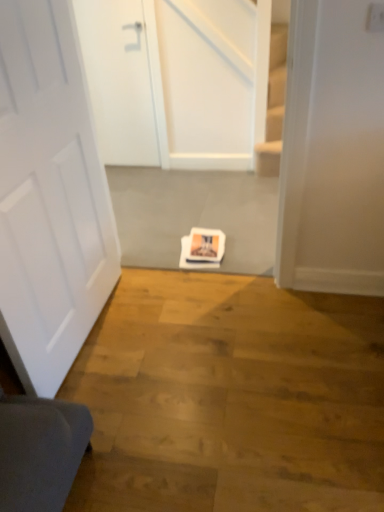
Question: From a real-world perspective, is white matte door at upper left, which ranks as the first door in top-to-bottom order, positioned above or below white matte door at center, the second door when ordered from back to front?

Choices:
 (A) below
 (B) above

Answer: (A)

Question: In terms of height, does white matte door at upper left, arranged as the 1th door when viewed from the back, look taller or shorter compared to white matte door at center, the second door when ordered from back to front?

Choices:
 (A) short
 (B) tall

Answer: (A)

Question: Is point (122, 59) positioned closer to the camera than point (29, 16)?

Choices:
 (A) closer
 (B) farther

Answer: (B)

Question: Considering the positions of white matte door at center, the 2th door from the top, and white matte door at upper left, which ranks as the first door in top-to-bottom order, in the image, is white matte door at center, the 2th door from the top, taller or shorter than white matte door at upper left, which ranks as the first door in top-to-bottom order,?

Choices:
 (A) tall
 (B) short

Answer: (A)

Question: Choose the correct answer: Is white matte door at center, the 2th door from the top, inside white matte door at upper left, the 2th door viewed from the front, or outside it?

Choices:
 (A) inside
 (B) outside

Answer: (B)

Question: Is white matte door at center, arranged as the first door when ordered from the bottom, wider or thinner than white matte door at upper left, the 2th door viewed from the front?

Choices:
 (A) wide
 (B) thin

Answer: (B)

Question: Does point (21, 336) appear closer or farther from the camera than point (109, 73)?

Choices:
 (A) closer
 (B) farther

Answer: (A)